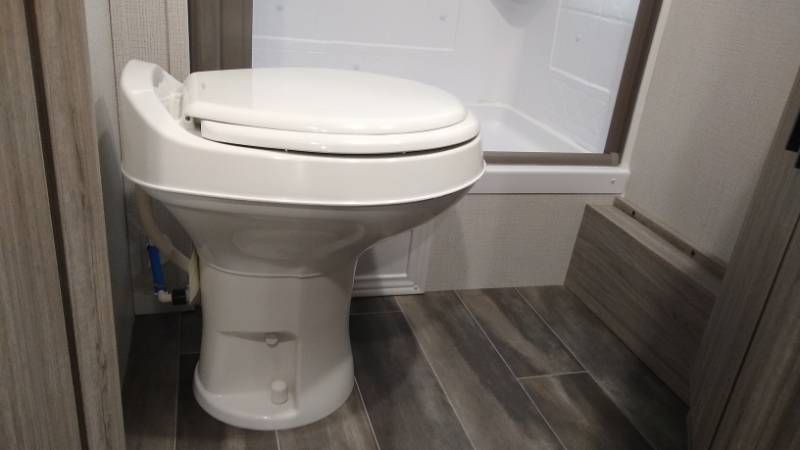
Locate an element on the screen. The width and height of the screenshot is (800, 450). ceramic is located at coordinates (280, 328).